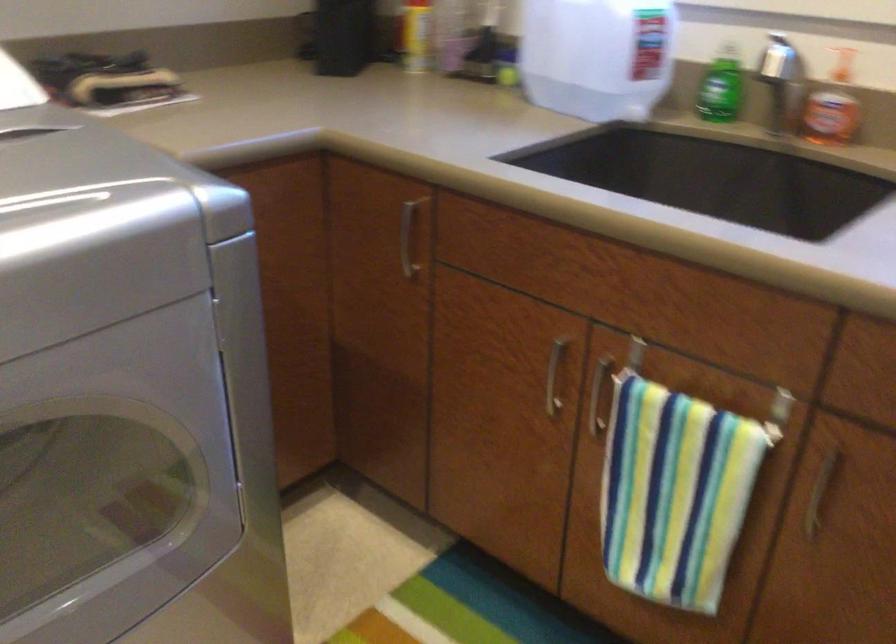
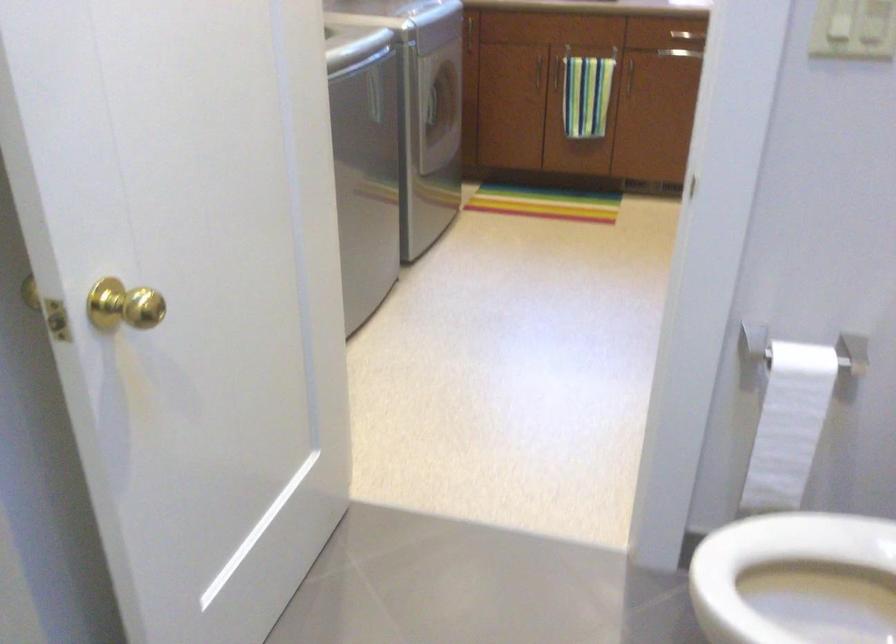
Which direction would the cameraman need to move to produce the second image?

The cameraman walked toward left, backward.